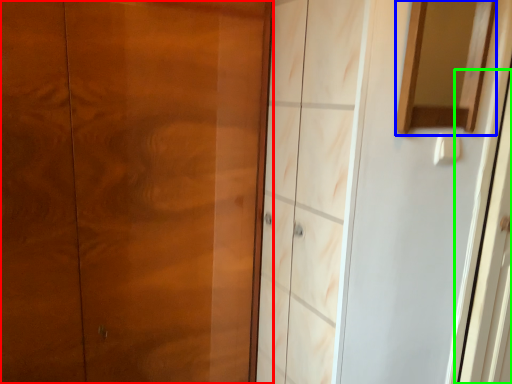
Question: Estimate the real-world distances between objects in this image. Which object is farther from door (highlighted by a red box), mirror (highlighted by a blue box) or screen door (highlighted by a green box)?

Choices:
 (A) mirror
 (B) screen door

Answer: (B)